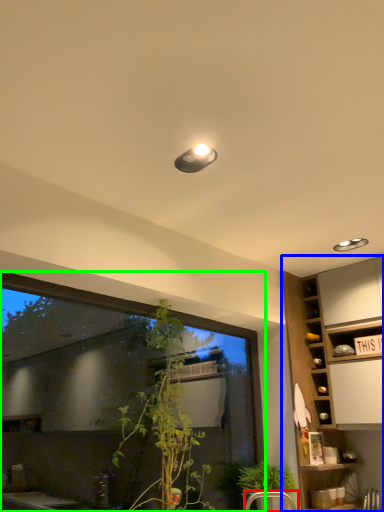
Question: Which object is positioned farthest from armchair (highlighted by a red box)? Select from cabinetry (highlighted by a blue box) and window (highlighted by a green box).

Choices:
 (A) cabinetry
 (B) window

Answer: (A)